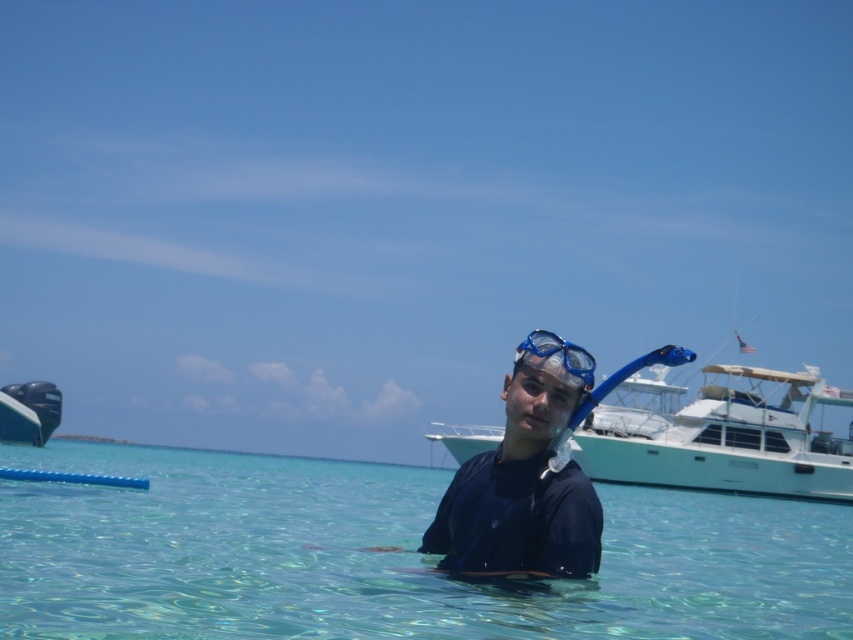
You are standing on the beach and want to walk to both the point at coordinates (256, 515) and the point at coordinates (819, 385). Which point will you reach first?

You will reach the point at coordinates (256, 515) first because it is closer to you than the point at coordinates (819, 385).

You are standing on the beach and want to take a photo of the yacht with the American flag. The camera you are using has a focal length of 50mm. If the yacht is located at point [845,456], which is 58.59 meters away from you, what is the approximate angle of view required to capture the yacht in the frame?

The angle of view required to capture the yacht at point [845,456], which is 58.59 meters away, can be calculated using the formula angle of view in degrees equals arctangent of object distance divided by focal length. Plugging in the values, the angle of view is approximately arctangent of 58.59 divided by 50, which equals approximately 50 degrees. Therefore, a 50mm lens with an angle of view around 50 degrees would be suitable to capture the yacht in the frame.

You are a photographer standing on the beach and want to capture both the white glossy boat at center and the blue glossy boat at left in a single photo. Which boat should you position closer to the center of your camera frame to ensure both are visible?

You should position the white glossy boat at center closer to the center of your camera frame because it is already positioned over the blue glossy boat at left, making it more central in the scene.